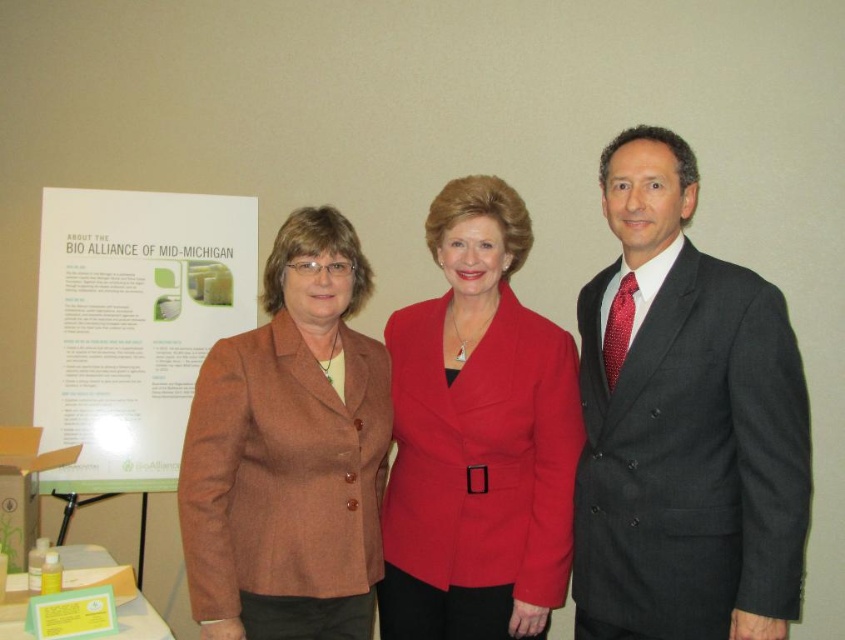
What is the exact 2D coordinate of the brown woolen blazer at center in the image?

The exact 2D coordinate of the brown woolen blazer at center is at point (290, 451).

You are a photographer at a formal event and need to ensure that all clothing items are visible in the photo. The dark gray suit at center and the brown woolen blazer at center are both in the frame. Which clothing item should you adjust to avoid being blocked by the other?

The dark gray suit at center is taller than the brown woolen blazer at center, so you should adjust the dark gray suit at center to prevent it from blocking the brown woolen blazer at center.